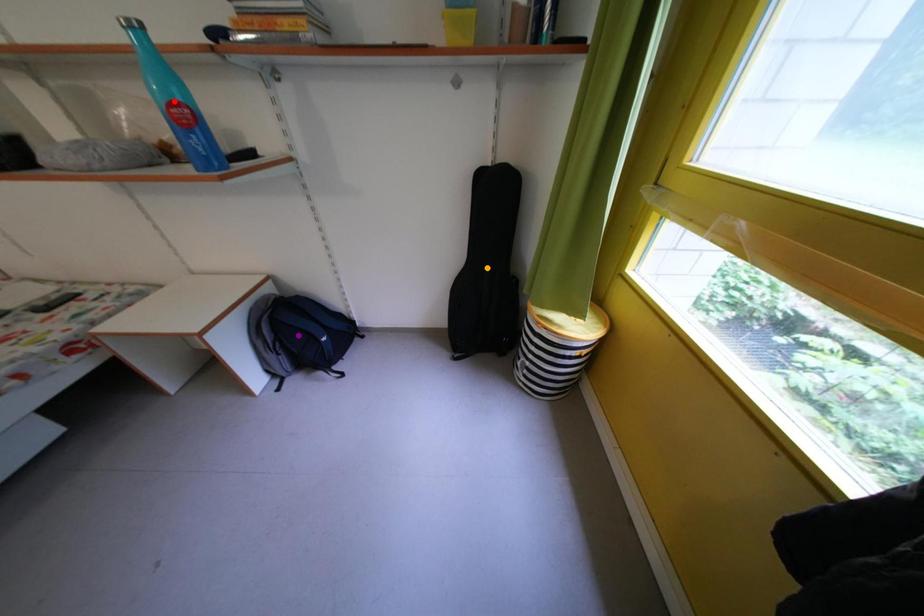
Order these from farthest to nearest:
A) orange point
B) purple point
C) red point

1. orange point
2. purple point
3. red point